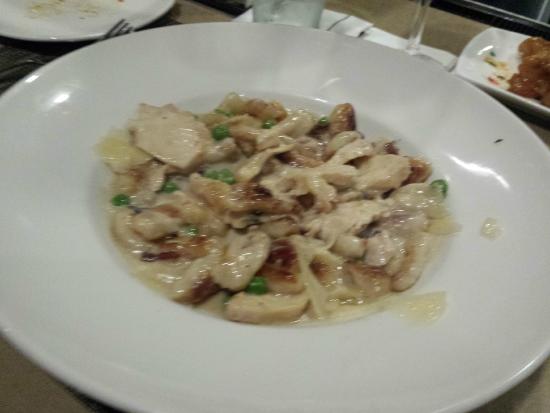
Locate an element on the screen. This screenshot has width=550, height=413. base of glass is located at coordinates (429, 54).